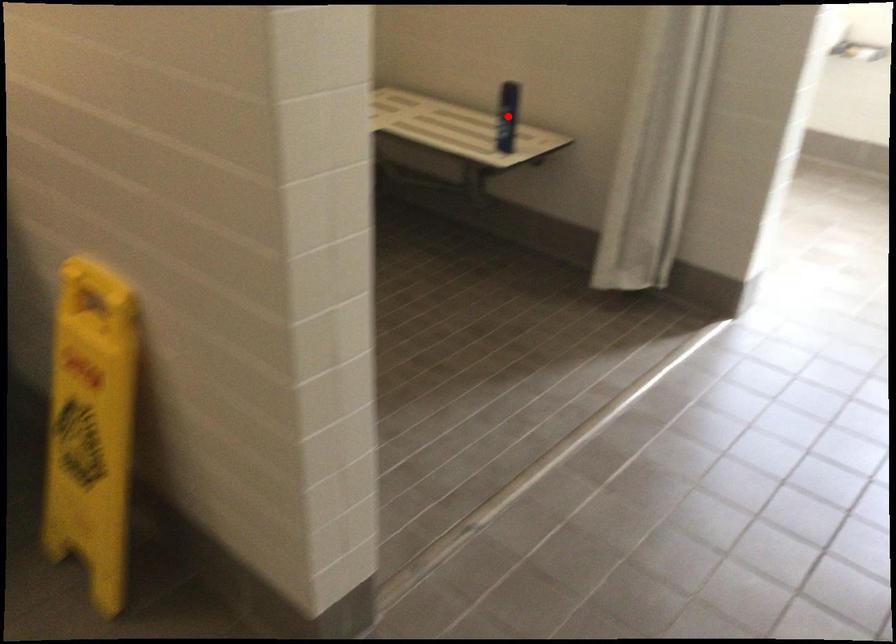
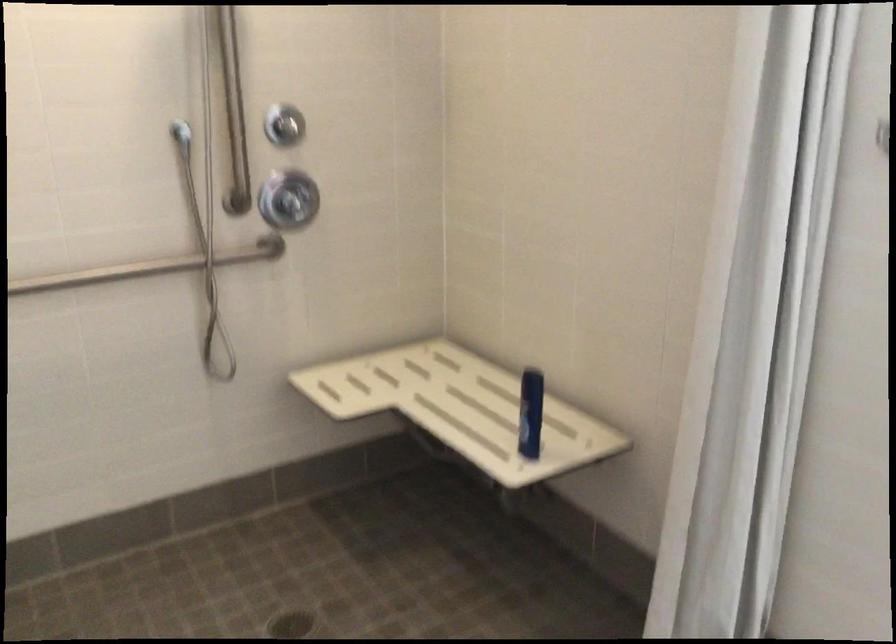
Locate, in the second image, the point that corresponds to the highlighted location in the first image.

(530, 413)